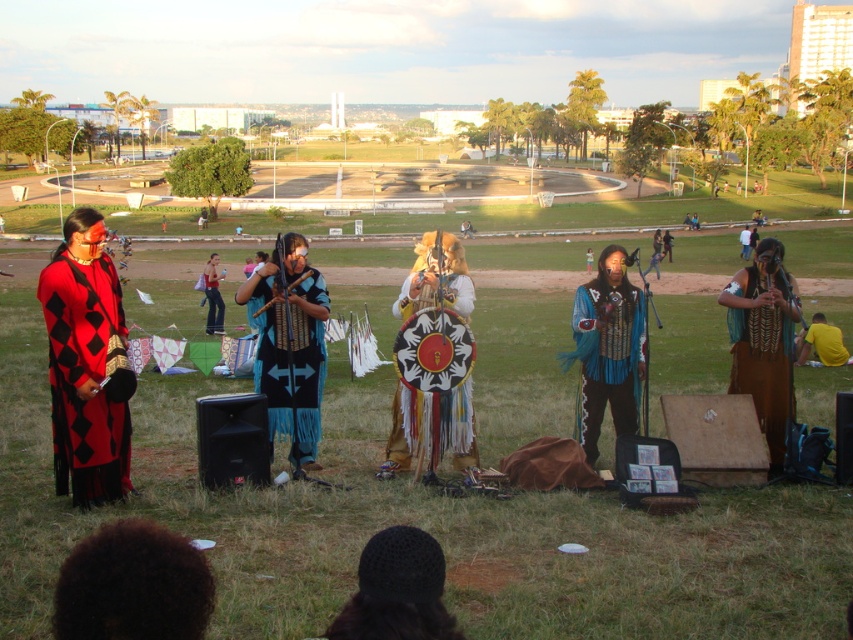
Does red/black checkered fabric at left lie in front of multicolored fringed shield at center?

That is True.

Does red/black checkered fabric at left come behind multicolored fringed shield at center?

No, red/black checkered fabric at left is closer to the viewer.

Is point (62, 451) positioned after point (398, 422)?

That is False.

Locate an element on the screen. red/black checkered fabric at left is located at coordinates [x=86, y=378].

Is red/black checkered fabric at left wider than yellow fabric at lower right?

No, red/black checkered fabric at left is not wider than yellow fabric at lower right.

Which is below, red/black checkered fabric at left or yellow fabric at lower right?

red/black checkered fabric at left is below.

Who is more forward, (131, 394) or (816, 340)?

Positioned in front is point (131, 394).

This screenshot has width=853, height=640. I want to click on red/black checkered fabric at left, so click(86, 378).

Describe the element at coordinates (86, 378) in the screenshot. This screenshot has width=853, height=640. I see `red/black checkered fabric at left` at that location.

Is point (91, 456) in front of point (669, 236)?

Yes, it is in front of point (669, 236).

The image size is (853, 640). In order to click on red/black checkered fabric at left in this screenshot , I will do `click(86, 378)`.